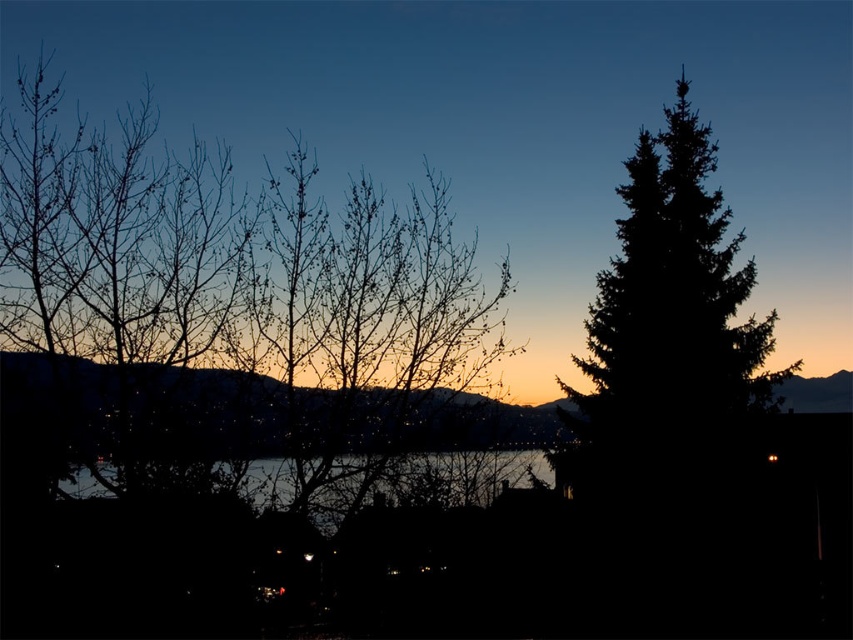
You are standing at the point marked by the coordinates point (666,328) in the twilight scene. Looking around, you see dark green textured tree at right. What is the nearest object to your current position?

The nearest object to your current position at point (666,328) is the dark green textured tree at right since it is located at the right side of the scene, closest to your position.

You are an observer standing in the twilight scene. You see the dark green textured tree at right and the transparent water at center. Which object is positioned to the right of the other?

The dark green textured tree at right is to the right of transparent water at center.